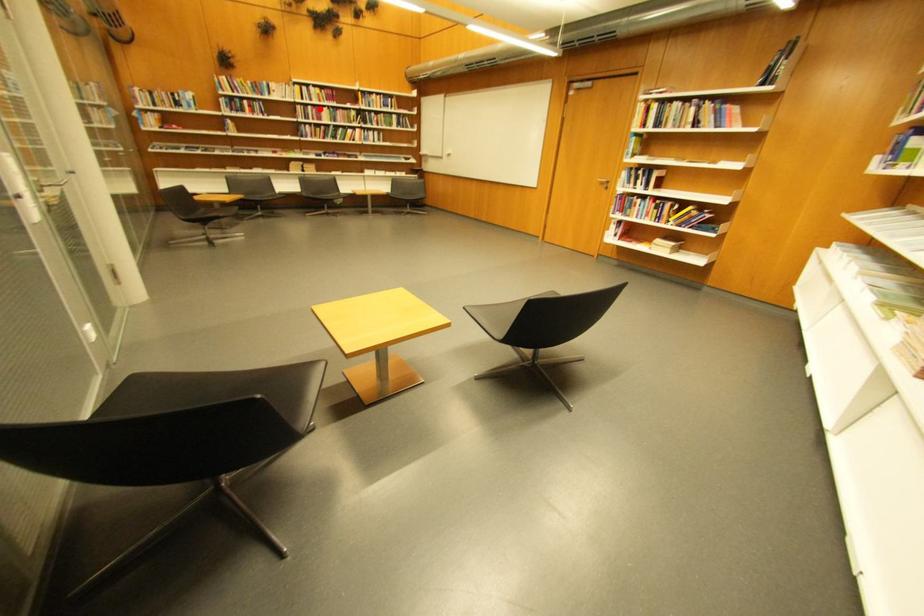
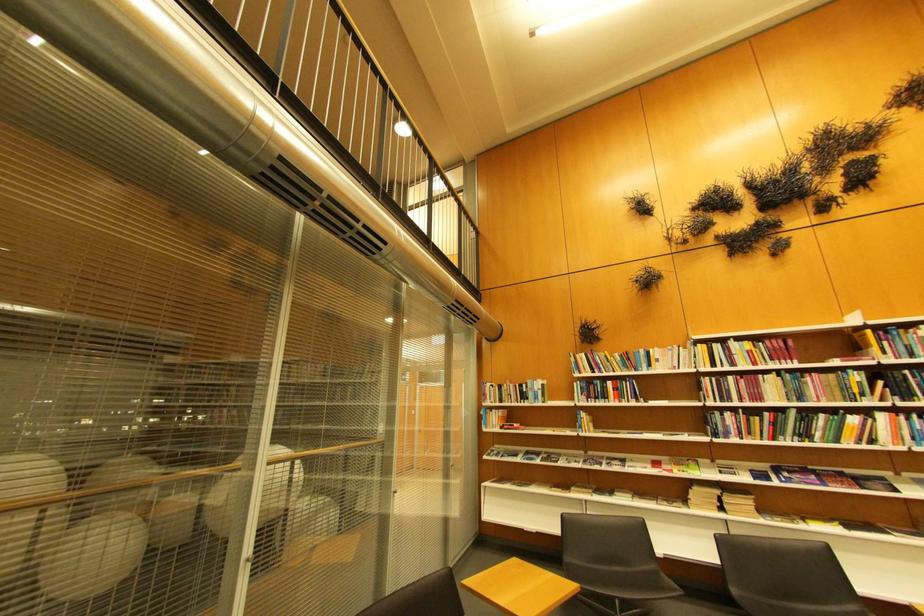
Question: I am providing you with two images of the same scene from different viewpoints. In image1, a red point is highlighted. Considering the same 3D point in image2, which of the following is correct?

Choices:
 (A) It is closer
 (B) It is farther

Answer: (B)